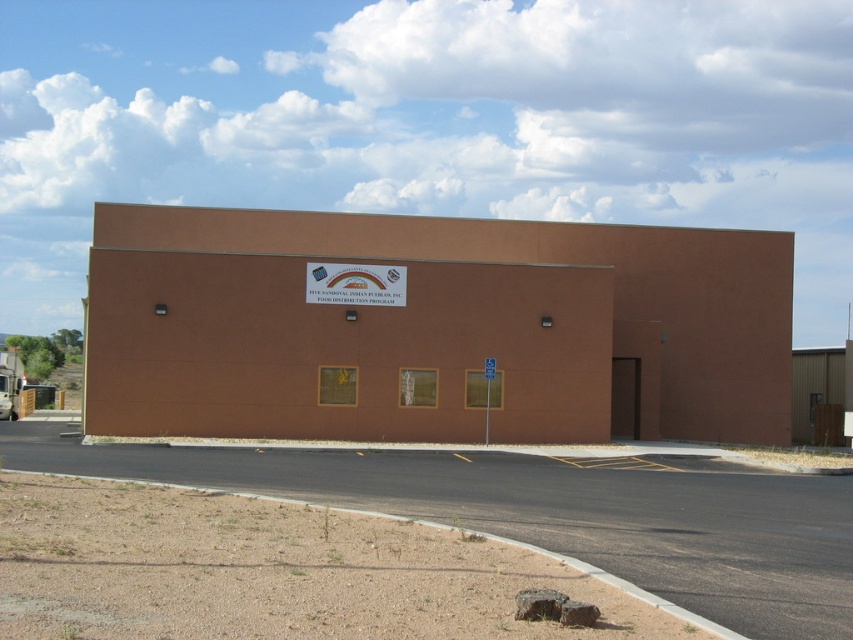
You are planning to paint the matte brown building at center and the white plastic sign at center. If you want to use the same amount of paint for both, which one would require more coats of paint?

The matte brown building at center has a larger size compared to the white plastic sign at center, so it would require more coats of paint to achieve the same coverage as the smaller sign.

You are standing in front of the building and want to locate two specific points marked on the facade. The first point is at coordinate point(489, 337) and the second is at point(316, 298). Which point is closer to the entrance on the right side of the building?

Point(316, 298) is closer to the entrance on the right side of the building because it is in front of point(489, 337).

You are a delivery driver who needs to park your truck next to the matte brown building at center. The truck is 4 meters tall. Can you park it there without hitting the white plastic sign at center?

The matte brown building at center is much taller than the white plastic sign at center, so the sign is lower. Since the truck is 4 meters tall, it might hit the sign if it parks too close. However, since the building is taller, the sign is likely positioned below the building height. To avoid collision, park the truck at a distance where the 4m height does not reach the sign. Alternatively, check the exact height of the sign before parking.